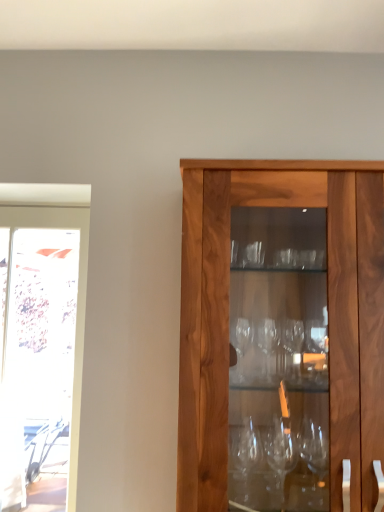
Question: Can we say transparent glass screen door at left lies outside walnut wood cabinet at center?

Choices:
 (A) yes
 (B) no

Answer: (A)

Question: Is transparent glass screen door at left touching walnut wood cabinet at center?

Choices:
 (A) yes
 (B) no

Answer: (B)

Question: From the image's perspective, is transparent glass screen door at left under walnut wood cabinet at center?

Choices:
 (A) yes
 (B) no

Answer: (A)

Question: Does transparent glass screen door at left have a lesser width compared to walnut wood cabinet at center?

Choices:
 (A) yes
 (B) no

Answer: (A)

Question: Is transparent glass screen door at left positioned with its back to walnut wood cabinet at center?

Choices:
 (A) yes
 (B) no

Answer: (B)

Question: Does transparent glass screen door at left have a larger size compared to walnut wood cabinet at center?

Choices:
 (A) yes
 (B) no

Answer: (B)

Question: From the image's perspective, is walnut wood cabinet at center beneath transparent glass screen door at left?

Choices:
 (A) no
 (B) yes

Answer: (A)

Question: Considering the relative positions of walnut wood cabinet at center and transparent glass screen door at left in the image provided, is walnut wood cabinet at center to the right of transparent glass screen door at left from the viewer's perspective?

Choices:
 (A) yes
 (B) no

Answer: (A)

Question: Could you tell me if walnut wood cabinet at center is facing transparent glass screen door at left?

Choices:
 (A) yes
 (B) no

Answer: (B)

Question: Is walnut wood cabinet at center positioned far away from transparent glass screen door at left?

Choices:
 (A) yes
 (B) no

Answer: (B)

Question: From the image's perspective, is walnut wood cabinet at center over transparent glass screen door at left?

Choices:
 (A) no
 (B) yes

Answer: (B)

Question: Is transparent glass screen door at left at the back of walnut wood cabinet at center?

Choices:
 (A) no
 (B) yes

Answer: (A)

Question: Is point (82, 216) positioned closer to the camera than point (307, 198)?

Choices:
 (A) farther
 (B) closer

Answer: (A)